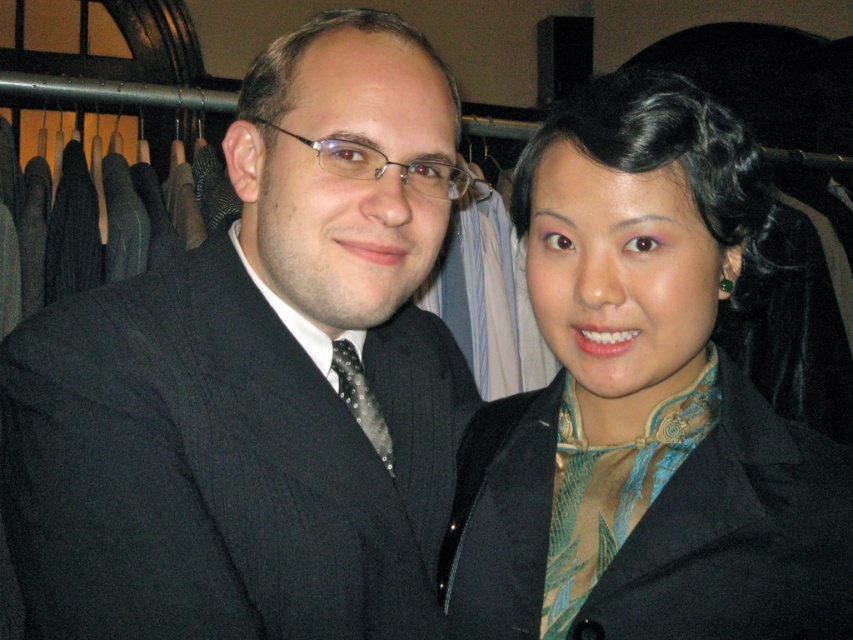
Question: Which point is farther to the camera?

Choices:
 (A) matte black coat at right
 (B) matte black suit at center

Answer: (B)

Question: Considering the relative positions of matte black coat at right and black dotted tie at center in the image provided, where is matte black coat at right located with respect to black dotted tie at center?

Choices:
 (A) below
 (B) above

Answer: (B)

Question: Among these objects, which one is nearest to the camera?

Choices:
 (A) matte black coat at right
 (B) matte black suit at center

Answer: (A)

Question: Is matte black suit at center closer to camera compared to matte black coat at right?

Choices:
 (A) no
 (B) yes

Answer: (A)

Question: Which of the following is the closest to the observer?

Choices:
 (A) matte black coat at right
 (B) matte black suit at center

Answer: (A)

Question: Observing the image, what is the correct spatial positioning of matte black suit at center in reference to black dotted tie at center?

Choices:
 (A) right
 (B) left

Answer: (B)